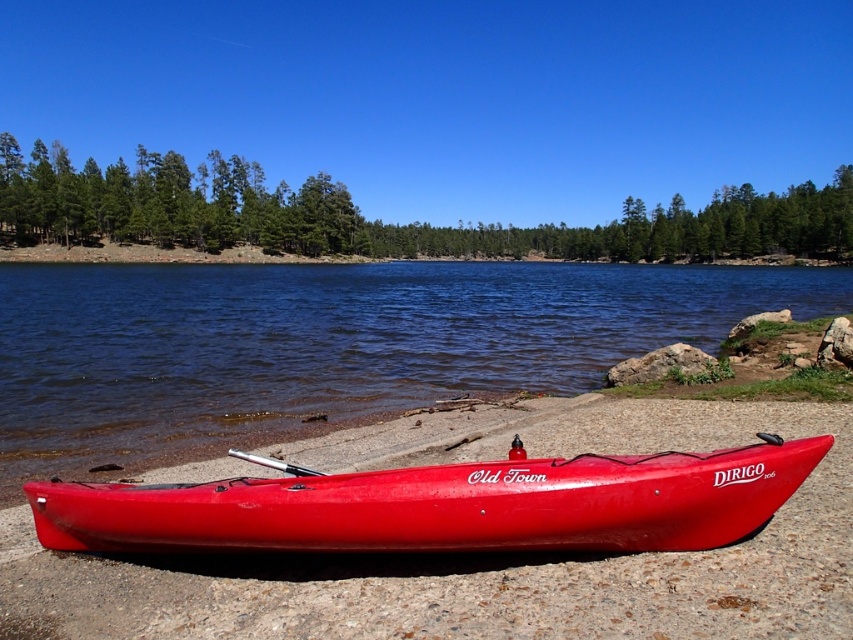
Does glossy water at center appear over silver metallic paddle at center?

Correct, glossy water at center is located above silver metallic paddle at center.

Does glossy water at center have a smaller size compared to silver metallic paddle at center?

No.

Between point (476, 337) and point (312, 474), which one is positioned in front?

Point (312, 474)

I want to click on glossy water at center, so click(x=329, y=344).

In the scene shown: Is glossy red kayak at lower center positioned before silver metallic paddle at center?

Yes, it is.

In the scene shown: Can you confirm if glossy red kayak at lower center is bigger than silver metallic paddle at center?

Correct, glossy red kayak at lower center is larger in size than silver metallic paddle at center.

Is point (431, 509) farther from viewer compared to point (276, 468)?

No, (431, 509) is in front of (276, 468).

Locate an element on the screen. Image resolution: width=853 pixels, height=640 pixels. glossy red kayak at lower center is located at coordinates (444, 504).

Is point (148, 394) positioned before point (178, 534)?

No, it is behind (178, 534).

In order to click on glossy water at center in this screenshot , I will do `click(329, 344)`.